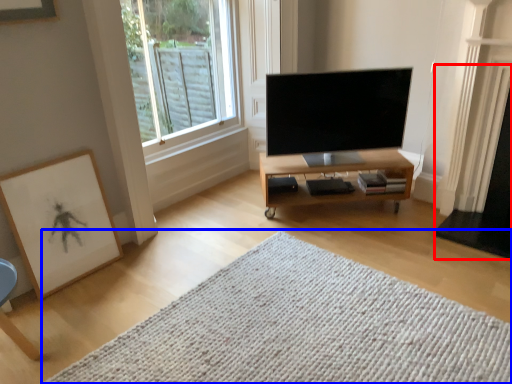
Question: Which object appears farthest to the camera in this image, fireplace (highlighted by a red box) or mat (highlighted by a blue box)?

Choices:
 (A) fireplace
 (B) mat

Answer: (A)